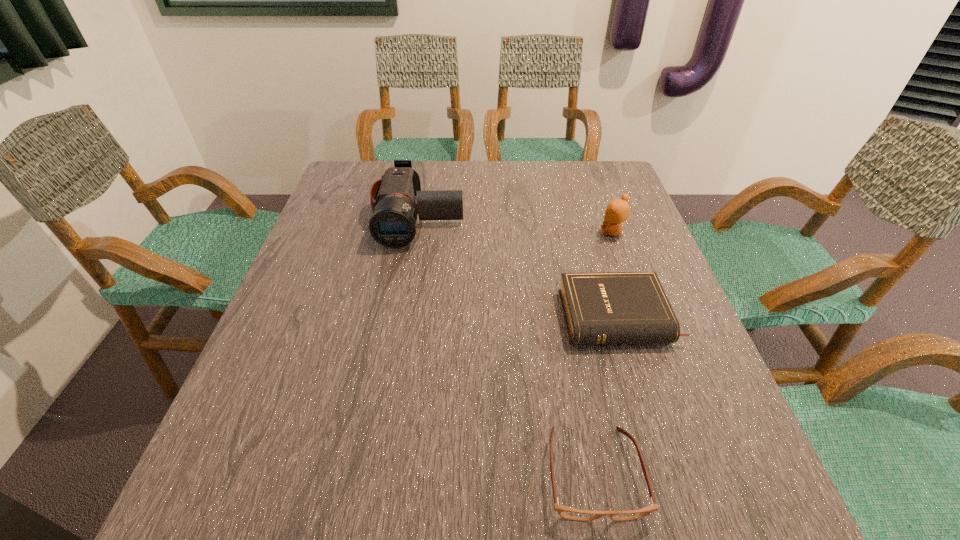
Where is `object that is positioned at the far edge`? This screenshot has height=540, width=960. object that is positioned at the far edge is located at coordinates (393, 224).

In order to click on object that is at the near edge in this screenshot , I will do pyautogui.click(x=566, y=512).

I want to click on object positioned at the left edge, so pos(393,224).

Image resolution: width=960 pixels, height=540 pixels. I want to click on teddy bear at the right edge, so click(618, 210).

Find the location of a particular element. The height and width of the screenshot is (540, 960). Bible at the right edge is located at coordinates (613, 307).

The width and height of the screenshot is (960, 540). In order to click on object present at the far left corner in this screenshot , I will do `click(393, 224)`.

This screenshot has width=960, height=540. I want to click on vacant point at the far edge, so click(x=551, y=162).

The width and height of the screenshot is (960, 540). Identify the location of vacant point at the near edge. coord(367,487).

At what (x,y) coordinates should I click in order to perform the action: click on blank space at the left edge of the desktop. Please return your answer as a coordinate pair (x, y). This screenshot has width=960, height=540. Looking at the image, I should click on (354, 277).

Locate an element on the screen. free region at the right edge of the desktop is located at coordinates (687, 321).